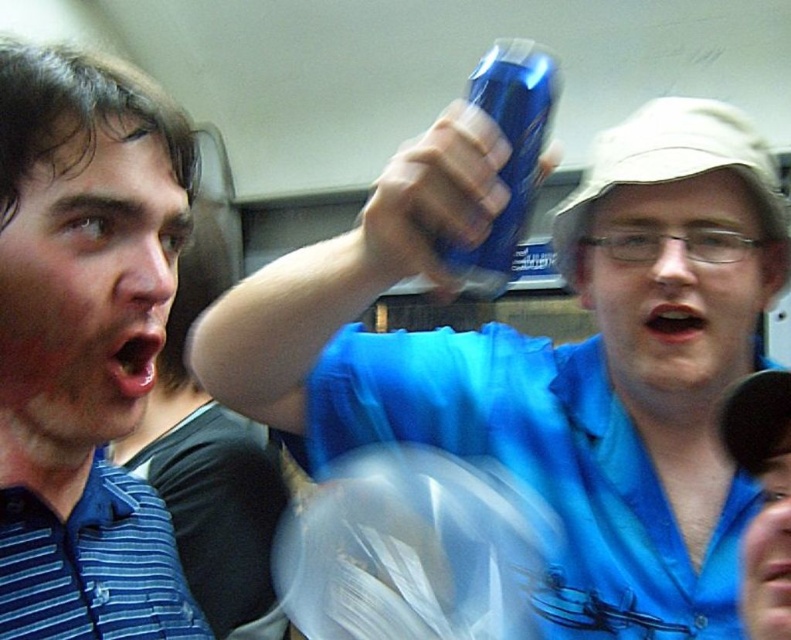
Measure the distance between blue glossy can at upper center and blue striped polo shirt at left.

blue glossy can at upper center is 9.95 inches away from blue striped polo shirt at left.

Who is taller, blue glossy can at upper center or blue striped polo shirt at left?

blue glossy can at upper center

The image size is (791, 640). Find the location of `blue glossy can at upper center`. blue glossy can at upper center is located at coordinates (549, 353).

Where is `blue glossy can at upper center`? blue glossy can at upper center is located at coordinates (549, 353).

Who is taller, blue glossy can at upper center or blue plastic can at upper center?

Standing taller between the two is blue glossy can at upper center.

Does blue glossy can at upper center appear on the right side of blue plastic can at upper center?

Correct, you'll find blue glossy can at upper center to the right of blue plastic can at upper center.

The width and height of the screenshot is (791, 640). Describe the element at coordinates (549, 353) in the screenshot. I see `blue glossy can at upper center` at that location.

Image resolution: width=791 pixels, height=640 pixels. What are the coordinates of `blue glossy can at upper center` in the screenshot? It's located at (549, 353).

Who is taller, blue striped polo shirt at left or blue plastic can at upper center?

With more height is blue striped polo shirt at left.

What do you see at coordinates (84, 342) in the screenshot?
I see `blue striped polo shirt at left` at bounding box center [84, 342].

Where is `blue striped polo shirt at left`? The width and height of the screenshot is (791, 640). blue striped polo shirt at left is located at coordinates (84, 342).